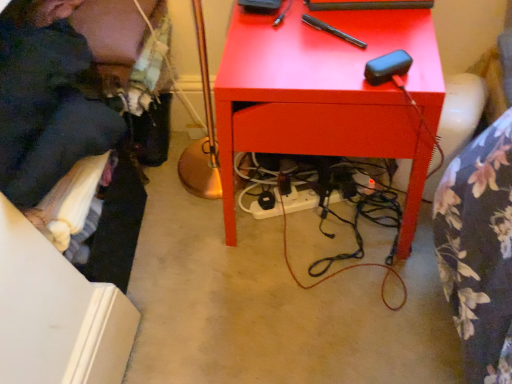
Question: Would you say dark blue fabric at left contains matte red desk at center?

Choices:
 (A) no
 (B) yes

Answer: (A)

Question: Could you tell me if dark blue fabric at left is facing matte red desk at center?

Choices:
 (A) no
 (B) yes

Answer: (B)

Question: Considering the relative sizes of dark blue fabric at left and matte red desk at center in the image provided, is dark blue fabric at left bigger than matte red desk at center?

Choices:
 (A) no
 (B) yes

Answer: (A)

Question: Considering the relative sizes of dark blue fabric at left and matte red desk at center in the image provided, is dark blue fabric at left shorter than matte red desk at center?

Choices:
 (A) no
 (B) yes

Answer: (A)

Question: Does dark blue fabric at left have a greater height compared to matte red desk at center?

Choices:
 (A) no
 (B) yes

Answer: (B)

Question: Can you confirm if dark blue fabric at left is wider than matte red desk at center?

Choices:
 (A) yes
 (B) no

Answer: (B)

Question: Does matte red desk at center come in front of dark blue fabric at left?

Choices:
 (A) yes
 (B) no

Answer: (A)

Question: Would you say matte red desk at center is outside dark blue fabric at left?

Choices:
 (A) yes
 (B) no

Answer: (A)

Question: Does matte red desk at center have a greater height compared to dark blue fabric at left?

Choices:
 (A) no
 (B) yes

Answer: (A)

Question: Is matte red desk at center far from dark blue fabric at left?

Choices:
 (A) no
 (B) yes

Answer: (A)

Question: Is matte red desk at center turned away from dark blue fabric at left?

Choices:
 (A) yes
 (B) no

Answer: (B)

Question: Is matte red desk at center shorter than dark blue fabric at left?

Choices:
 (A) yes
 (B) no

Answer: (A)

Question: In the image, is matte red desk at center positioned in front of or behind dark blue fabric at left?

Choices:
 (A) front
 (B) behind

Answer: (A)